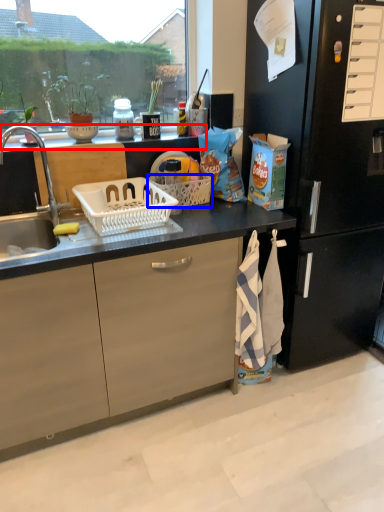
Question: Which point is further to the camera, window sill (highlighted by a red box) or picnic basket (highlighted by a blue box)?

Choices:
 (A) window sill
 (B) picnic basket

Answer: (B)